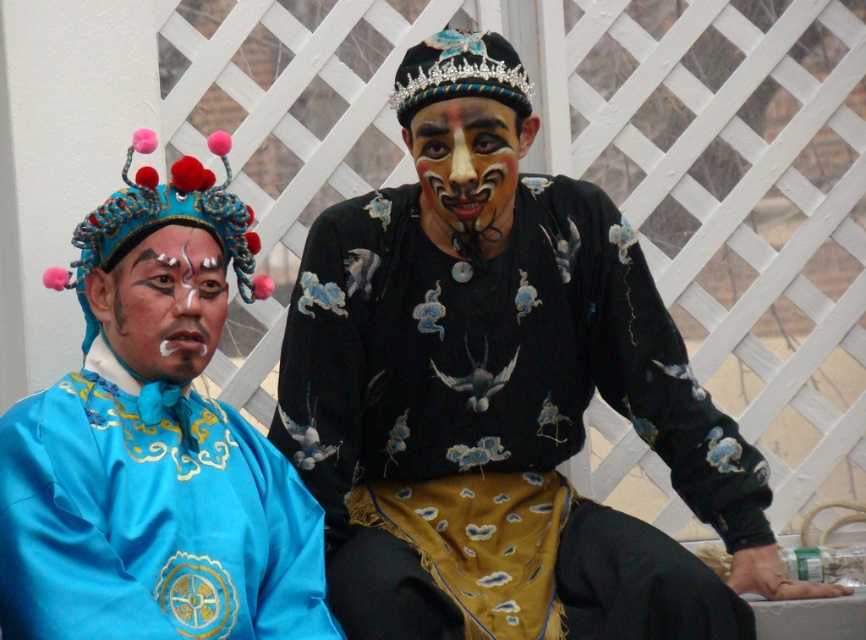
Question: Which object is the closest to the matte blue face at left?

Choices:
 (A) black velvet crown at upper center
 (B) painted face at center

Answer: (B)

Question: Can you confirm if black satin embroidered shirt at center is thinner than satin blue robe at left?

Choices:
 (A) yes
 (B) no

Answer: (B)

Question: Is painted face at center positioned at the back of black velvet crown at upper center?

Choices:
 (A) no
 (B) yes

Answer: (B)

Question: Which point is closer to the camera?

Choices:
 (A) blue fabric/cloth crown at upper left
 (B) matte blue face at left
 (C) black velvet crown at upper center

Answer: (A)

Question: Which object is the closest to the black velvet crown at upper center?

Choices:
 (A) painted face at center
 (B) black satin embroidered shirt at center
 (C) satin blue robe at left

Answer: (A)

Question: Is satin blue robe at left positioned in front of blue fabric/cloth crown at upper left?

Choices:
 (A) yes
 (B) no

Answer: (B)